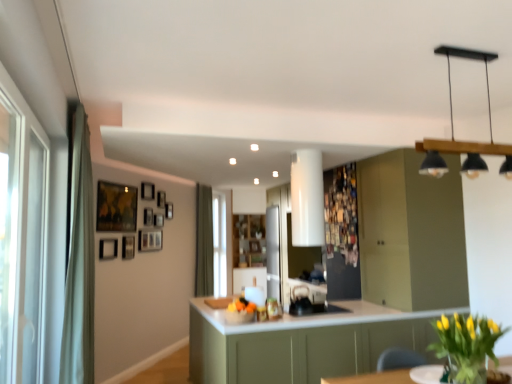
Question: Is yellow-green leafy plant at lower right smaller than wooden framed map at upper left, placed as the 1th picture frame when sorted from front to back?

Choices:
 (A) no
 (B) yes

Answer: (A)

Question: Is yellow-green leafy plant at lower right positioned in front of wooden framed map at upper left, the ninth picture frame in the back-to-front sequence?

Choices:
 (A) no
 (B) yes

Answer: (B)

Question: Can we say yellow-green leafy plant at lower right lies outside wooden framed map at upper left, placed as the 1th picture frame when sorted from front to back?

Choices:
 (A) yes
 (B) no

Answer: (A)

Question: From a real-world perspective, is yellow-green leafy plant at lower right positioned under wooden framed map at upper left, the ninth picture frame in the back-to-front sequence, based on gravity?

Choices:
 (A) yes
 (B) no

Answer: (A)

Question: Does yellow-green leafy plant at lower right contain wooden framed map at upper left, placed as the 1th picture frame when sorted from front to back?

Choices:
 (A) yes
 (B) no

Answer: (B)

Question: Are yellow-green leafy plant at lower right and wooden framed map at upper left, the ninth picture frame in the back-to-front sequence, far apart?

Choices:
 (A) yes
 (B) no

Answer: (A)

Question: From the image's perspective, is black matte light fixture at upper right under wooden picture frame at upper center, the 2th picture frame when ordered from back to front?

Choices:
 (A) no
 (B) yes

Answer: (A)

Question: Can we say black matte light fixture at upper right lies outside wooden picture frame at upper center, the 2th picture frame when ordered from back to front?

Choices:
 (A) yes
 (B) no

Answer: (A)

Question: From the image's perspective, is black matte light fixture at upper right on wooden picture frame at upper center, the 2th picture frame when ordered from back to front?

Choices:
 (A) yes
 (B) no

Answer: (A)

Question: Is the depth of black matte light fixture at upper right less than that of wooden picture frame at upper center, the eighth picture frame viewed from the front?

Choices:
 (A) no
 (B) yes

Answer: (B)

Question: Does black matte light fixture at upper right have a greater height compared to wooden picture frame at upper center, the 2th picture frame when ordered from back to front?

Choices:
 (A) no
 (B) yes

Answer: (B)

Question: Can you confirm if black matte light fixture at upper right is bigger than wooden picture frame at upper center, the 2th picture frame when ordered from back to front?

Choices:
 (A) no
 (B) yes

Answer: (B)

Question: Is matte black picture frame at upper left, placed as the 8th picture frame when sorted from back to front, not inside wooden picture frame at upper left, the 9th picture frame from the front?

Choices:
 (A) no
 (B) yes

Answer: (B)